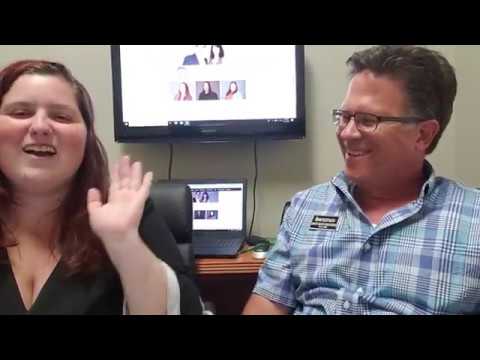
Identify the location of laptop screen. (231, 209).